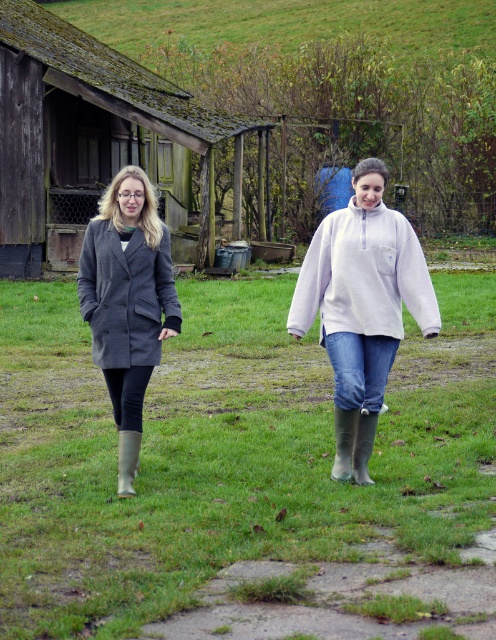
Is gray woolen coat at left further to the viewer compared to green rubber boot at lower left?

Yes.

Does point (98, 317) come behind point (127, 477)?

Yes, point (98, 317) is farther from viewer.

Does point (107, 326) come behind point (133, 456)?

Yes, point (107, 326) is behind point (133, 456).

Where is `gray woolen coat at left`? gray woolen coat at left is located at coordinates (125, 294).

Who is higher up, fuzzy white sweater at center or gray woolen coat at left?

Positioned higher is fuzzy white sweater at center.

You are a GUI agent. You are given a task and a screenshot of the screen. Output one action in this format:
    pyautogui.click(x=<x>, y=<y>)
    Task: Click on the fuzzy white sweater at center
    
    Given the screenshot: What is the action you would take?
    pyautogui.click(x=363, y=289)

Where is `fuzzy white sweater at center`? This screenshot has height=640, width=496. fuzzy white sweater at center is located at coordinates (363, 289).

Is matte gray coat at left bigger than green rubber boot at lower left?

Yes.

Does matte gray coat at left appear over green rubber boot at lower left?

Indeed, matte gray coat at left is positioned over green rubber boot at lower left.

Is point (141, 358) behind point (122, 472)?

That is False.

The image size is (496, 640). I want to click on matte gray coat at left, so click(127, 301).